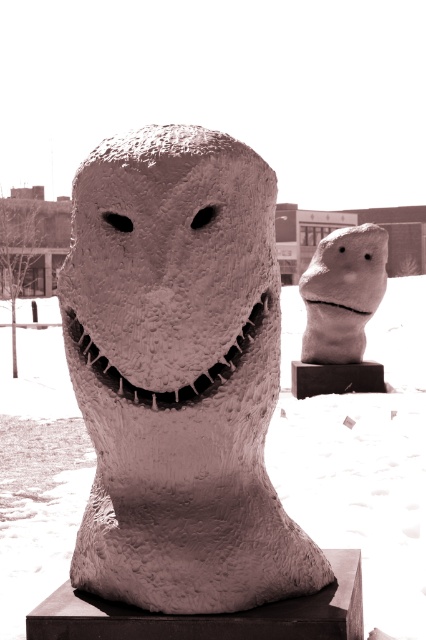
Question: Which object is closer to the camera taking this photo?

Choices:
 (A) fuzzy white snow at center
 (B) white matte stone head at center
 (C) fuzzy textured sculpture at center

Answer: (C)

Question: Is fuzzy white snow at center closer to camera compared to white matte stone head at center?

Choices:
 (A) yes
 (B) no

Answer: (A)

Question: Is fuzzy white snow at center smaller than fuzzy textured sculpture at center?

Choices:
 (A) no
 (B) yes

Answer: (A)

Question: Is fuzzy white snow at center further to the viewer compared to white matte stone head at center?

Choices:
 (A) no
 (B) yes

Answer: (A)

Question: Which point appears closest to the camera in this image?

Choices:
 (A) (420, 508)
 (B) (287, 552)

Answer: (B)

Question: Which object appears farthest from the camera in this image?

Choices:
 (A) white matte stone head at center
 (B) textured stone head at center
 (C) fuzzy textured sculpture at center
 (D) fuzzy white snow at center

Answer: (A)